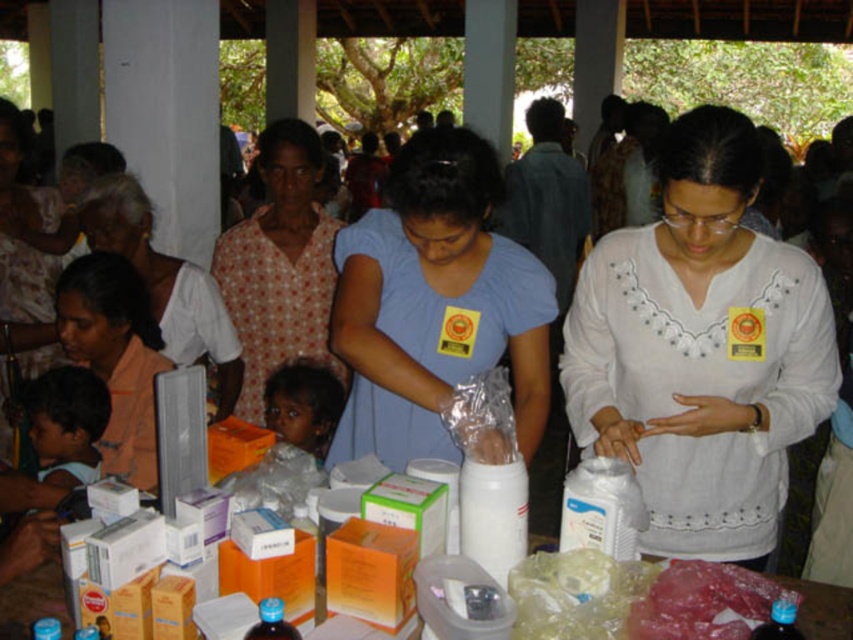
Question: Which of the following is the farthest from the observer?

Choices:
 (A) white cotton shirt at center
 (B) blue plastic bottle at center
 (C) white plastic container at center

Answer: (A)

Question: Can you confirm if matte pink shirt at lower left is thinner than transparent plastic bottle at center?

Choices:
 (A) no
 (B) yes

Answer: (A)

Question: Can you confirm if matte blue shirt at center is wider than matte pink shirt at lower left?

Choices:
 (A) yes
 (B) no

Answer: (A)

Question: Among these objects, which one is nearest to the camera?

Choices:
 (A) dark skin baby at center
 (B) floral fabric dress at center

Answer: (A)

Question: Is white cotton shirt at center to the right of smooth skin child at lower left from the viewer's perspective?

Choices:
 (A) no
 (B) yes

Answer: (B)

Question: Which object is farther from the camera taking this photo?

Choices:
 (A) smooth skin child at lower left
 (B) floral fabric dress at center
 (C) transparent plastic bottle at center

Answer: (B)